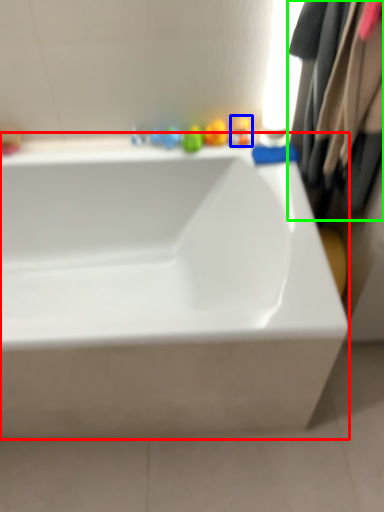
Question: Which is farther away from bathtub (highlighted by a red box)? toy (highlighted by a blue box) or clothing (highlighted by a green box)?

Choices:
 (A) toy
 (B) clothing

Answer: (A)